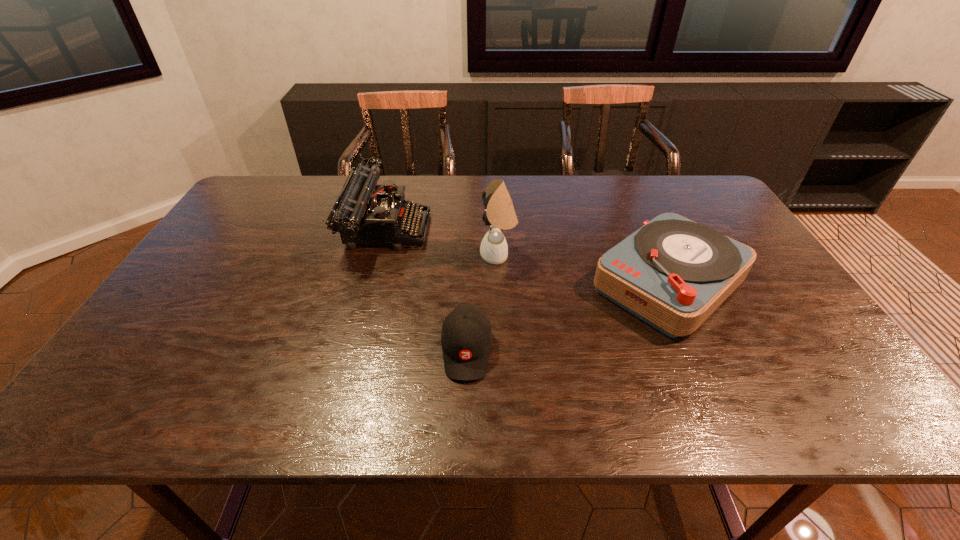
At what (x,y) coordinates should I click in order to perform the action: click on object that stands as the second closest to the leftmost object. Please return your answer as a coordinate pair (x, y). This screenshot has width=960, height=540. Looking at the image, I should click on (466, 337).

Locate an element on the screen. object that is the second closest to the doll is located at coordinates (466, 337).

You are a GUI agent. You are given a task and a screenshot of the screen. Output one action in this format:
    pyautogui.click(x=<x>, y=<y>)
    Task: Click on the free spot that satisfies the following two spatial constraints: 1. on the keyboard of the second shortest object; 2. on the left side of the second tallest object
    The width and height of the screenshot is (960, 540).
    Given the screenshot: What is the action you would take?
    pyautogui.click(x=372, y=282)

Locate an element on the screen. free region that satisfies the following two spatial constraints: 1. at the front face of the tallest object; 2. with a logo on the front of the shortest object is located at coordinates (502, 350).

Image resolution: width=960 pixels, height=540 pixels. I want to click on vacant space that satisfies the following two spatial constraints: 1. at the front face of the rightmost object; 2. on the right side of the doll, so click(499, 282).

Find the location of a particular element. vacant space that satisfies the following two spatial constraints: 1. on the back side of the second shortest object; 2. at the front face of the doll is located at coordinates (657, 255).

At what (x,y) coordinates should I click in order to perform the action: click on free location that satisfies the following two spatial constraints: 1. at the front face of the second shortest object; 2. on the right side of the tallest object. Please return your answer as a coordinate pair (x, y). The height and width of the screenshot is (540, 960). Looking at the image, I should click on (499, 282).

At what (x,y) coordinates should I click in order to perform the action: click on free space that satisfies the following two spatial constraints: 1. on the keyboard of the typewriter; 2. on the right side of the record player. Please return your answer as a coordinate pair (x, y). Looking at the image, I should click on (372, 282).

Locate an element on the screen. vacant point that satisfies the following two spatial constraints: 1. at the front face of the rightmost object; 2. on the right side of the doll is located at coordinates (499, 282).

This screenshot has height=540, width=960. Identify the location of vacant region that satisfies the following two spatial constraints: 1. on the back side of the record player; 2. at the front face of the tallest object. (657, 255).